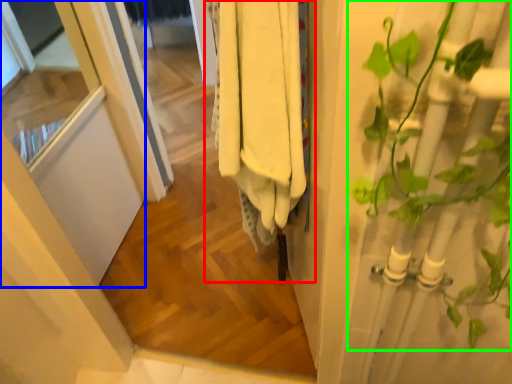
Question: Estimate the real-world distances between objects in this image. Which object is closer to closet (highlighted by a red box), screen door (highlighted by a blue box) or houseplant (highlighted by a green box)?

Choices:
 (A) screen door
 (B) houseplant

Answer: (B)